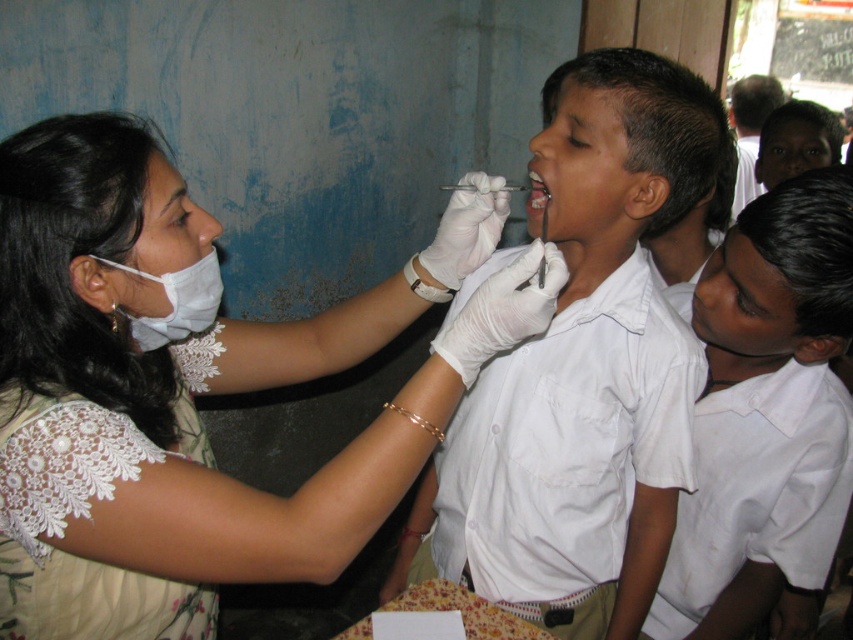
Between white lace dress at center and white uniform shirt at center, which one has less height?

Standing shorter between the two is white lace dress at center.

This screenshot has height=640, width=853. I want to click on white lace dress at center, so click(x=192, y=388).

Does point (21, 300) lie in front of point (167, 289)?

Yes, it is in front of point (167, 289).

Consider the image. Can you confirm if white lace dress at center is positioned below white fabric mask at upper left?

Yes.

Between point (135, 490) and point (151, 330), which one is positioned in front?

Point (135, 490)

You are a GUI agent. You are given a task and a screenshot of the screen. Output one action in this format:
    pyautogui.click(x=<x>, y=<y>)
    Task: Click on the white lace dress at center
    Image resolution: width=853 pixels, height=640 pixels.
    Given the screenshot: What is the action you would take?
    pyautogui.click(x=192, y=388)

Does point (351, 550) come in front of point (619, 593)?

Yes, it is.

Is point (143, 248) more distant than point (554, 368)?

That is False.

Locate an element on the screen. Image resolution: width=853 pixels, height=640 pixels. white lace dress at center is located at coordinates (192, 388).